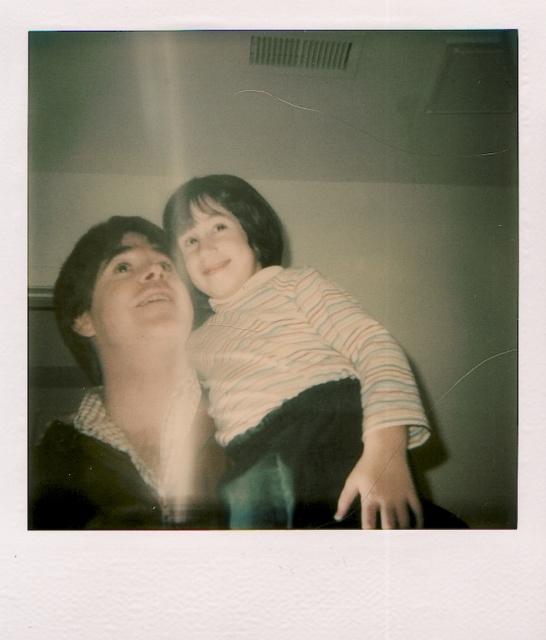
Is striped fabric shirt at center to the right of matte black shirt at center from the viewer's perspective?

Indeed, striped fabric shirt at center is positioned on the right side of matte black shirt at center.

At what (x,y) coordinates should I click in order to perform the action: click on striped fabric shirt at center. Please return your answer as a coordinate pair (x, y). Looking at the image, I should click on (293, 364).

I want to click on striped fabric shirt at center, so click(x=293, y=364).

In order to click on striped fabric shirt at center in this screenshot , I will do `click(293, 364)`.